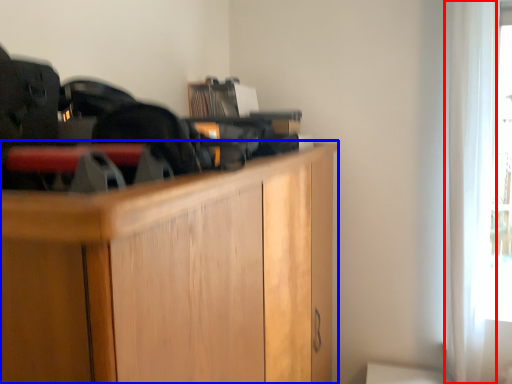
Question: Which object is closer to the camera taking this photo, curtain (highlighted by a red box) or cabinetry (highlighted by a blue box)?

Choices:
 (A) curtain
 (B) cabinetry

Answer: (B)